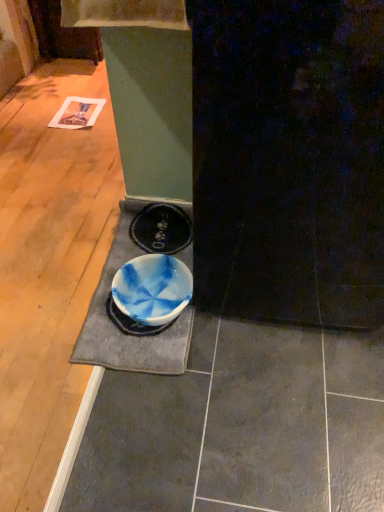
Question: In terms of height, does blue marbled bowl at center look taller or shorter compared to blue marbled doormat at center?

Choices:
 (A) short
 (B) tall

Answer: (B)

Question: Is blue marbled bowl at center to the left or to the right of blue marbled doormat at center in the image?

Choices:
 (A) left
 (B) right

Answer: (B)

Question: From a real-world perspective, is blue marbled bowl at center above or below blue marbled doormat at center?

Choices:
 (A) above
 (B) below

Answer: (A)

Question: Is point click(142, 360) positioned closer to the camera than point click(155, 279)?

Choices:
 (A) closer
 (B) farther

Answer: (A)

Question: Considering the positions of blue marbled doormat at center and blue marbled bowl at center in the image, is blue marbled doormat at center taller or shorter than blue marbled bowl at center?

Choices:
 (A) tall
 (B) short

Answer: (B)

Question: Choose the correct answer: Is blue marbled doormat at center inside blue marbled bowl at center or outside it?

Choices:
 (A) inside
 (B) outside

Answer: (A)

Question: Based on their positions, is blue marbled doormat at center located to the left or right of blue marbled bowl at center?

Choices:
 (A) left
 (B) right

Answer: (A)